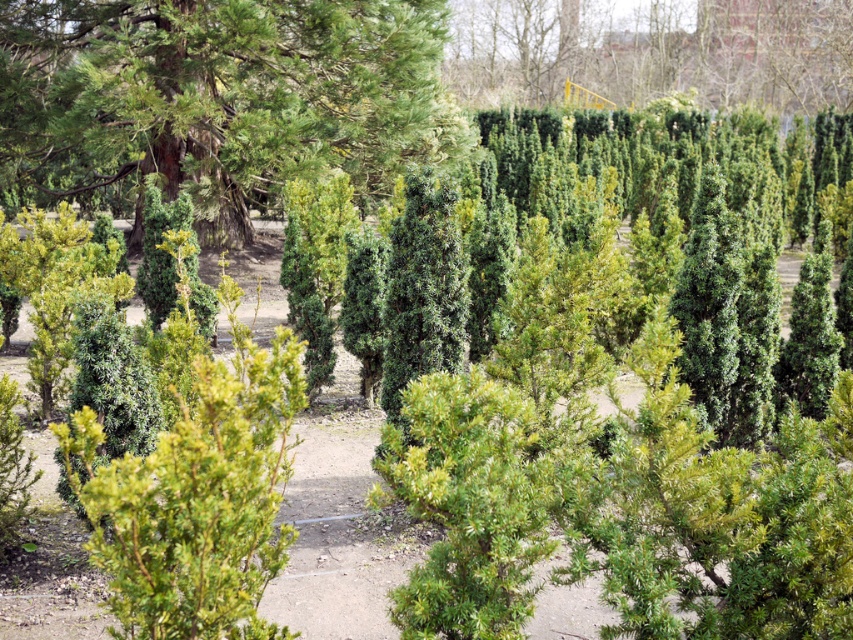
Question: Among these points, which one is farthest from the camera?

Choices:
 (A) (833, 83)
 (B) (227, 96)

Answer: (A)

Question: Among these objects, which one is farthest from the camera?

Choices:
 (A) green textured tree at upper left
 (B) green textured hedge at upper center

Answer: (B)

Question: Is green textured tree at upper left to the right of green textured hedge at upper center from the viewer's perspective?

Choices:
 (A) no
 (B) yes

Answer: (A)

Question: Can you confirm if green textured tree at upper left is positioned below green textured hedge at upper center?

Choices:
 (A) yes
 (B) no

Answer: (A)

Question: Does green textured tree at upper left appear under green textured hedge at upper center?

Choices:
 (A) yes
 (B) no

Answer: (A)